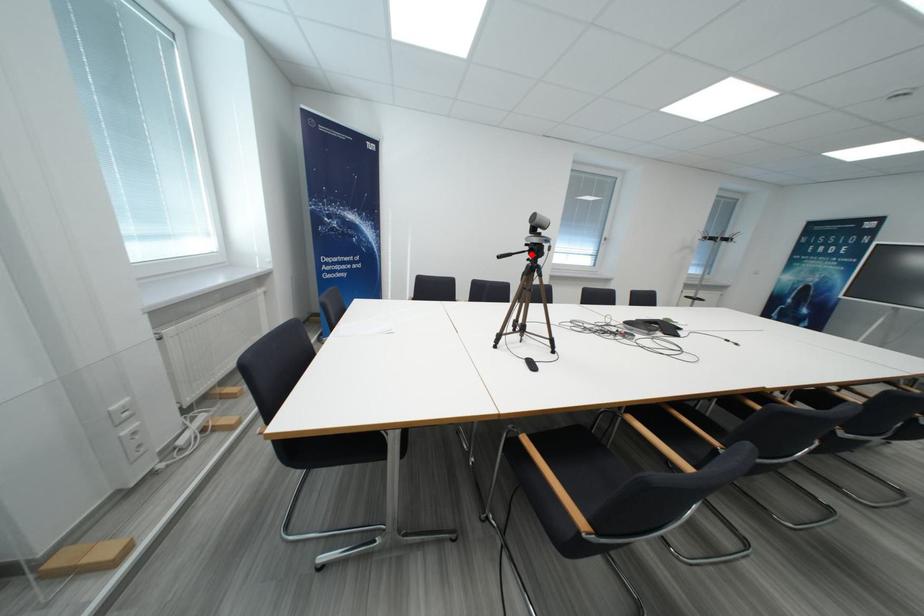
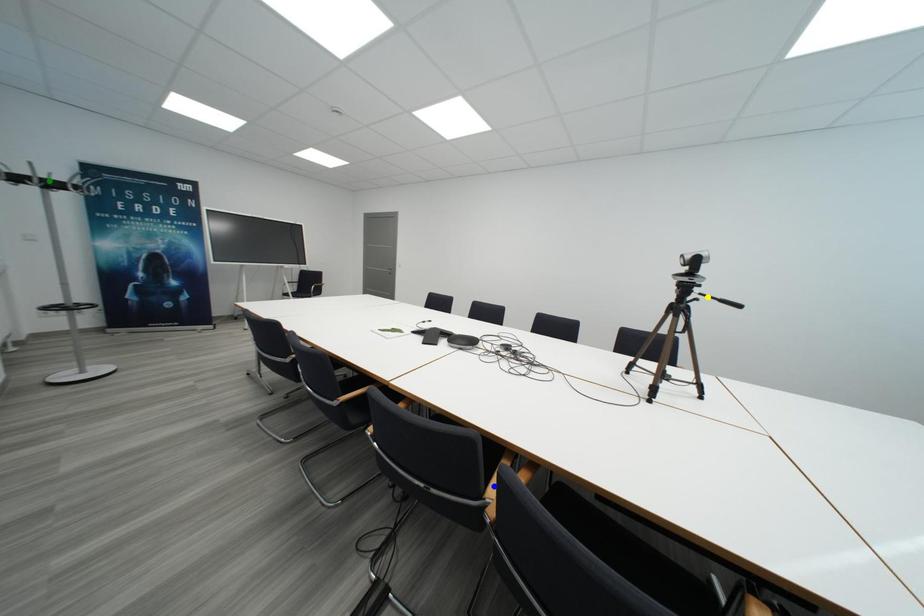
Question: I am providing you with two images of the same scene from different viewpoints. A red point is marked on the first image. You are given multiple points on the second image. Which point in image 2 is actually the same real-world point as the red point in image 1?

Choices:
 (A) yellow point
 (B) green point
 (C) blue point

Answer: (A)